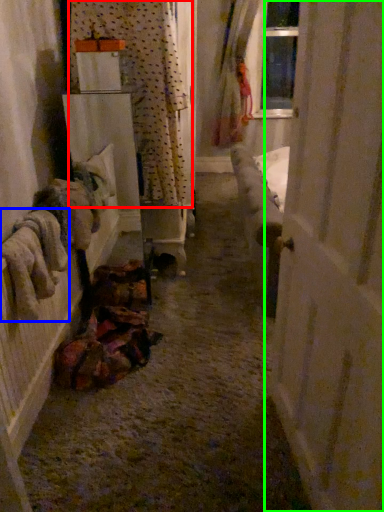
Question: Which is farther away from curtain (highlighted by a red box)? clothing (highlighted by a blue box) or door (highlighted by a green box)?

Choices:
 (A) clothing
 (B) door

Answer: (B)